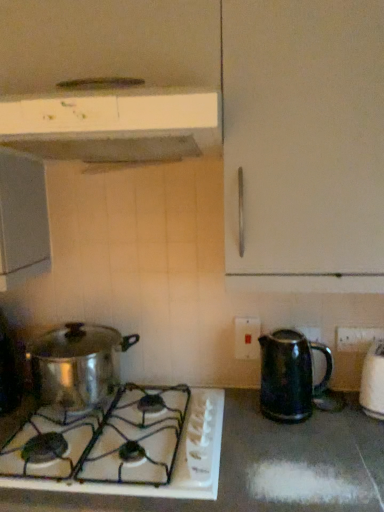
What are the coordinates of `vacant space in shiny metallic kettle at right, marked as the 3th kitchen appliance in a top-to-bottom arrangement (from a real-world perspective)` in the screenshot? It's located at (300, 415).